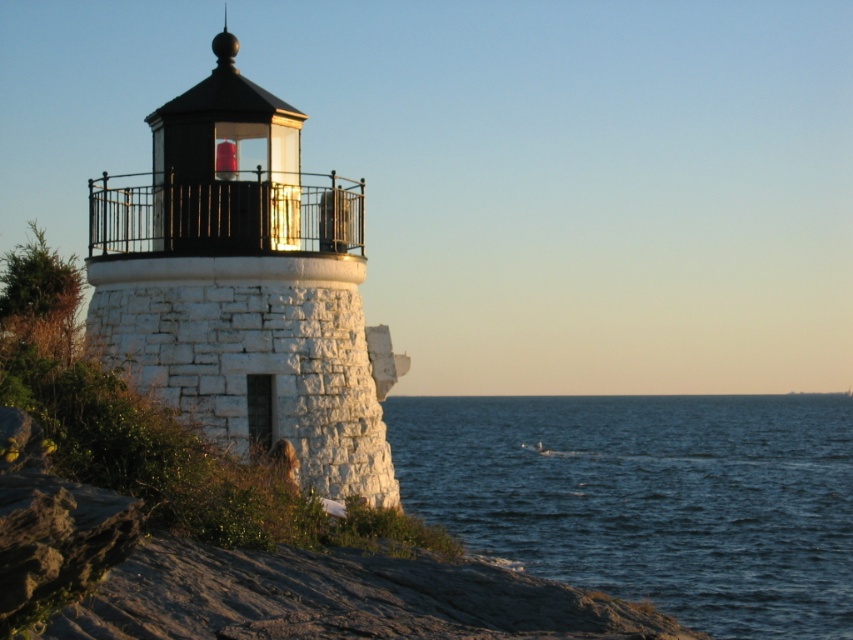
You are a delivery drone carrying a package to the white stone lighthouse at center. You are currently hovering above the blue water at lower right. What is the minimum distance you need to fly to reach the lighthouse?

The minimum distance you need to fly is 34.98 meters from the blue water at lower right to the white stone lighthouse at center.

You are a photographer planning to capture the white stone lighthouse at center and the blue water at lower right in a single frame. Based on their sizes in the image, which object will appear larger in your photograph?

The white stone lighthouse at center appears larger than the blue water at lower right because it is taller.